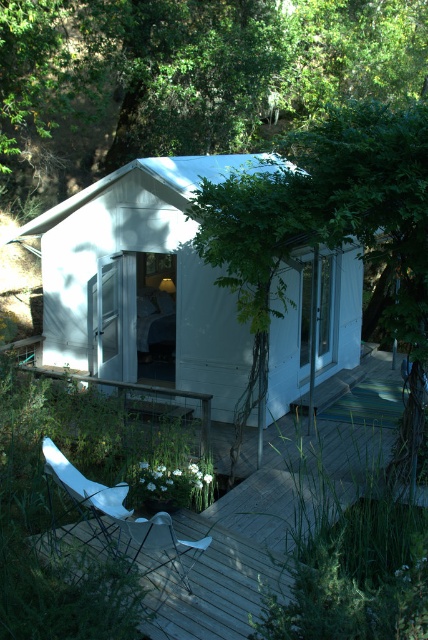
Question: Among these objects, which one is farthest from the camera?

Choices:
 (A) white matte hut at center
 (B) wooden deck at center

Answer: (A)

Question: From the image, what is the correct spatial relationship of wooden deck at center in relation to white plastic chair at lower left?

Choices:
 (A) right
 (B) left

Answer: (A)

Question: Which point is closer to the camera?

Choices:
 (A) white matte hut at center
 (B) white plastic chair at lower left

Answer: (B)

Question: Does white matte hut at center come in front of white plastic chair at lower left?

Choices:
 (A) no
 (B) yes

Answer: (A)

Question: Which point appears closest to the camera in this image?

Choices:
 (A) (94, 285)
 (B) (104, 547)

Answer: (B)

Question: Observing the image, what is the correct spatial positioning of white matte hut at center in reference to wooden deck at center?

Choices:
 (A) above
 (B) below

Answer: (A)